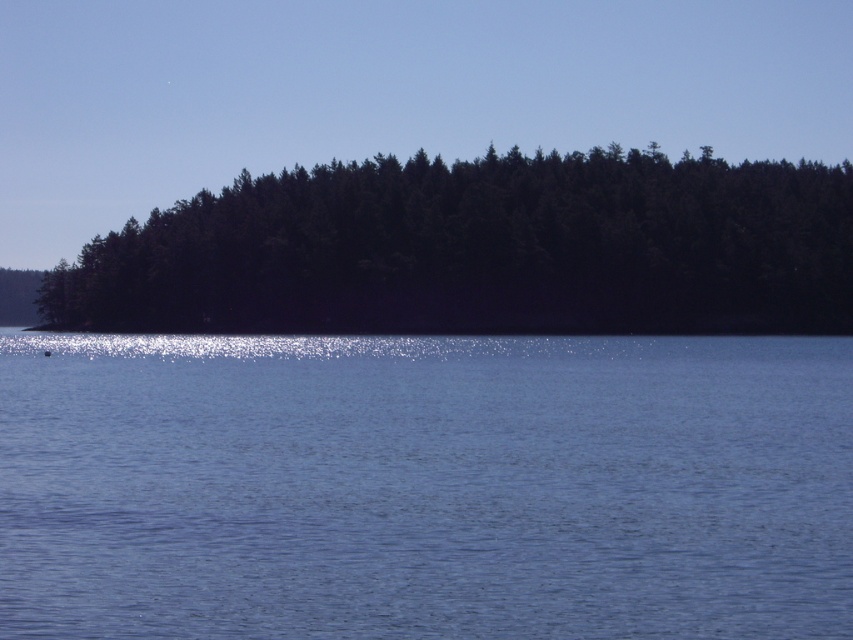
You are standing at the edge of the water in the scene and want to reach the dense forested island in the background. There are two points marked on your path. Which point is closer to you, point (758, 592) or point (177, 248)?

Point (758, 592) is closer to the viewer than point (177, 248), so you should head towards point (758, 592) first as it is nearer to your current position.

You are standing at the edge of the water and want to place a small floating marker exactly at the center of the blue liquid water at center. According to the coordinates provided, where should you place the marker?

The blue liquid water at center is located at point (424, 486), so you should place the marker at those coordinates to mark its center.